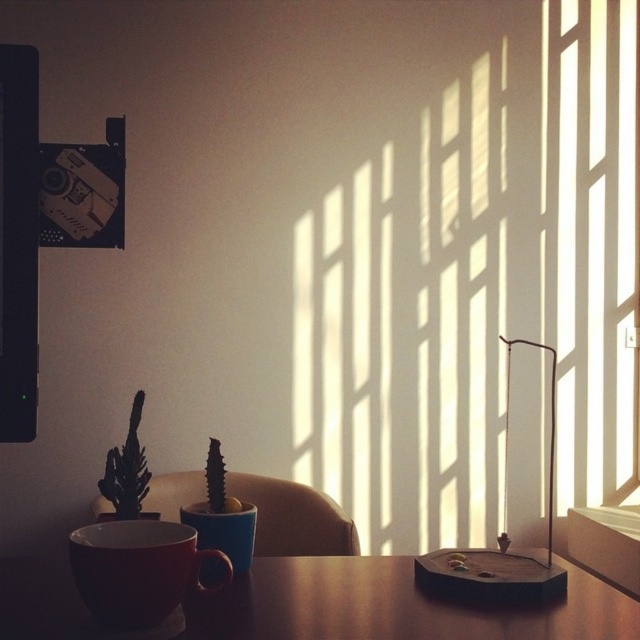
You are standing in the room depicted in the image. There are two points marked in the scene. The first point is at coordinates point [163,582] and the second is at point [93,499]. Which of these two points is closer to you?

Point [163,582] is closer to the viewer than point [93,499].

You are arranging items on a shelf and need to place the matte ceramic mug at lower center and the matte ceramic cup at center. According to their positions in the image, which one should you place first to maintain the correct arrangement?

You should place the matte ceramic cup at center first because the matte ceramic mug at lower center is to the right of it, so positioning the cup first allows you to correctly place the mug to its right side.